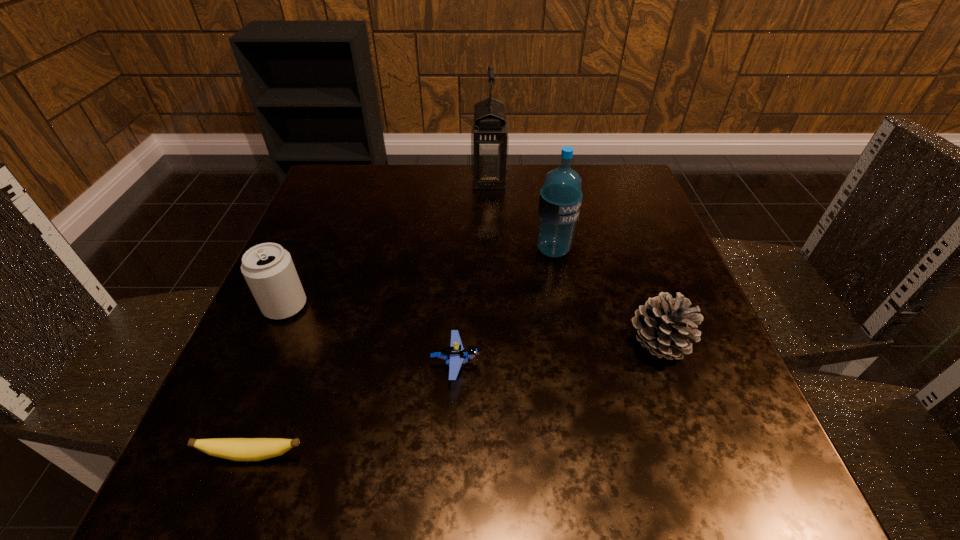
Identify the location of the farthest object. Image resolution: width=960 pixels, height=540 pixels. (489, 136).

Locate an element on the screen. the second farthest object is located at coordinates (560, 200).

You are a GUI agent. You are given a task and a screenshot of the screen. Output one action in this format:
    pyautogui.click(x=<x>, y=<y>)
    Task: Click on the fifth object from left to right
    The height and width of the screenshot is (540, 960).
    Given the screenshot: What is the action you would take?
    pyautogui.click(x=560, y=200)

The image size is (960, 540). Find the location of `can`. can is located at coordinates (268, 269).

This screenshot has width=960, height=540. I want to click on the third shortest object, so click(663, 324).

Locate an element on the screen. The width and height of the screenshot is (960, 540). the rightmost object is located at coordinates (663, 324).

This screenshot has width=960, height=540. I want to click on the fifth tallest object, so click(455, 355).

I want to click on the shortest object, so click(237, 449).

This screenshot has height=540, width=960. I want to click on the nearest object, so pyautogui.click(x=237, y=449).

At what (x,y) coordinates should I click in order to perform the action: click on free space located on the front-facing side of the lantern. Please return your answer as a coordinate pair (x, y). This screenshot has height=540, width=960. Looking at the image, I should click on pos(432,179).